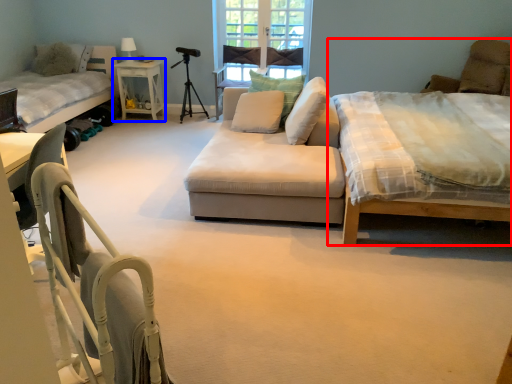
Question: Which point is closer to the camera, bed (highlighted by a red box) or table (highlighted by a blue box)?

Choices:
 (A) bed
 (B) table

Answer: (A)